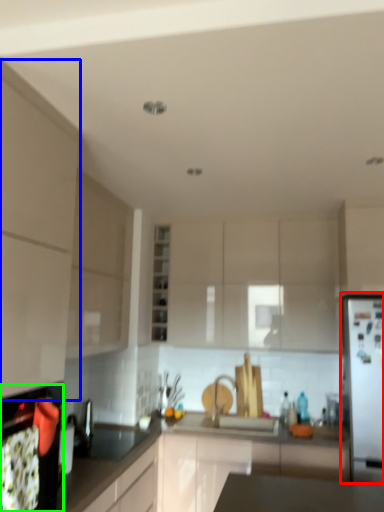
Question: Which object is the farthest from fridge (highlighted by a red box)? Choose among these: cabinetry (highlighted by a blue box) or oven (highlighted by a green box).

Choices:
 (A) cabinetry
 (B) oven

Answer: (A)